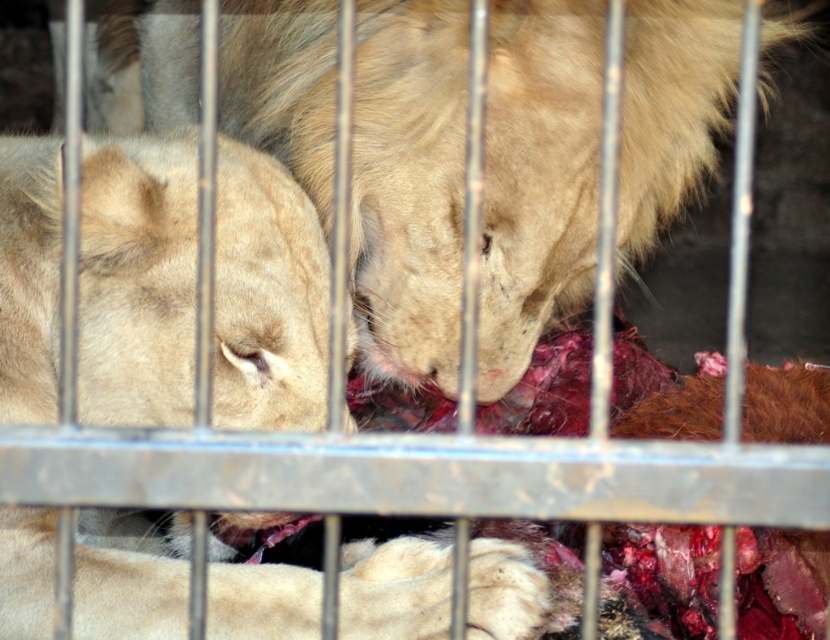
Question: Which point appears closest to the camera in this image?

Choices:
 (A) (550, 125)
 (B) (115, 616)

Answer: (B)

Question: Does light brown fur at center appear under light beige fur at center?

Choices:
 (A) yes
 (B) no

Answer: (B)

Question: Does light brown fur at center appear under light beige fur at center?

Choices:
 (A) yes
 (B) no

Answer: (B)

Question: Does light brown fur at center appear on the left side of light beige fur at center?

Choices:
 (A) yes
 (B) no

Answer: (B)

Question: Among these points, which one is farthest from the camera?

Choices:
 (A) tap(625, 35)
 (B) tap(160, 400)

Answer: (A)